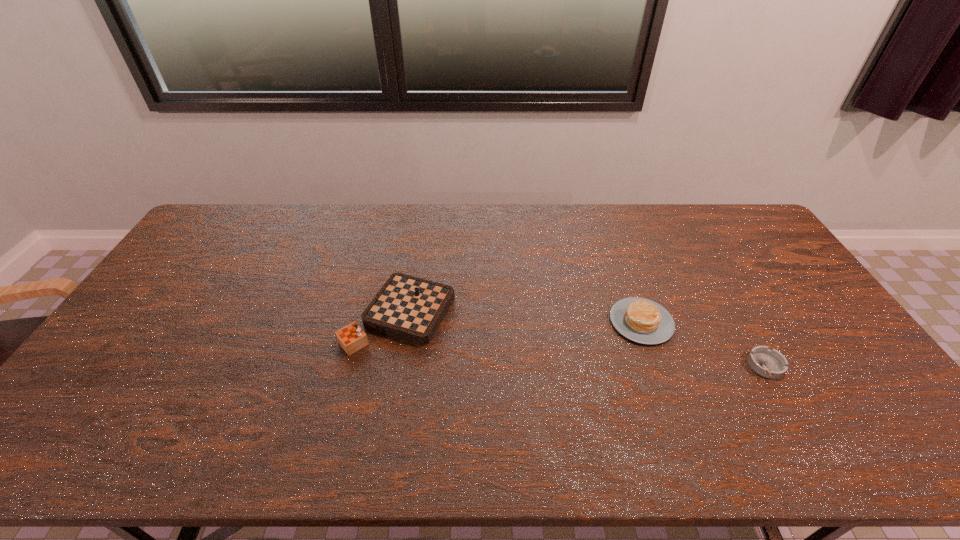
Where is `vacant space at the near edge of the desktop`? The image size is (960, 540). vacant space at the near edge of the desktop is located at coordinates (280, 448).

Locate an element on the screen. The image size is (960, 540). blank space at the left edge of the desktop is located at coordinates (183, 253).

Where is `free space at the right edge of the desktop`? The height and width of the screenshot is (540, 960). free space at the right edge of the desktop is located at coordinates (851, 360).

In the image, there is a desktop. Identify the location of blank space at the far left corner. [x=235, y=207].

The image size is (960, 540). What are the coordinates of `free point at the near right corner` in the screenshot? It's located at (881, 456).

The image size is (960, 540). Find the location of `free point between the chessboard and the shortest object`. free point between the chessboard and the shortest object is located at coordinates (583, 341).

Find the location of a particular element. empty space that is in between the shortest object and the pancake is located at coordinates (704, 344).

Where is `unoccupied position between the chessboard and the ashtray`? unoccupied position between the chessboard and the ashtray is located at coordinates (583, 341).

Find the location of a particular element. The height and width of the screenshot is (540, 960). unoccupied position between the ashtray and the second object from right to left is located at coordinates (704, 344).

This screenshot has width=960, height=540. Identify the location of vacant space that's between the chessboard and the pancake. (520, 319).